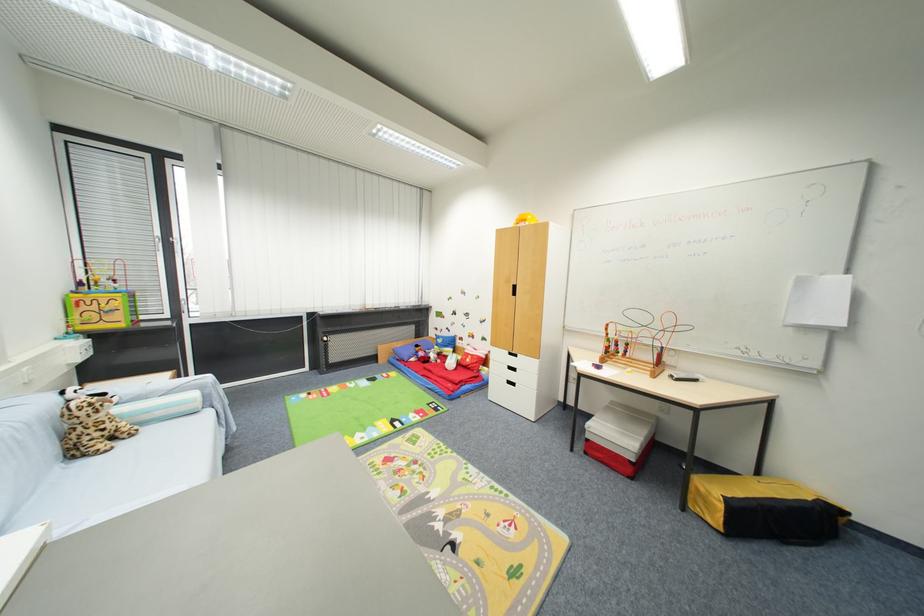
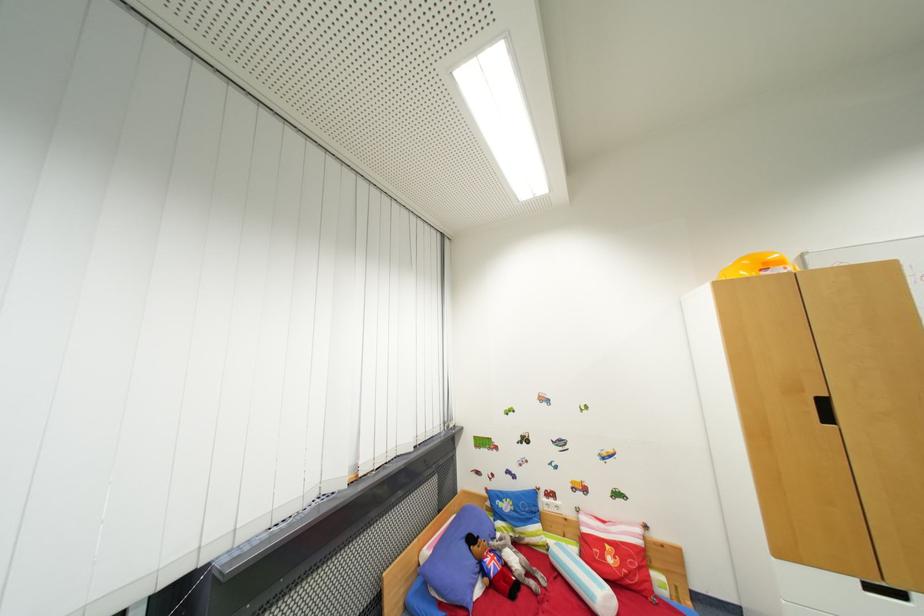
What movement of the cameraman would produce the second image?

The cameraman moved toward left, forward.